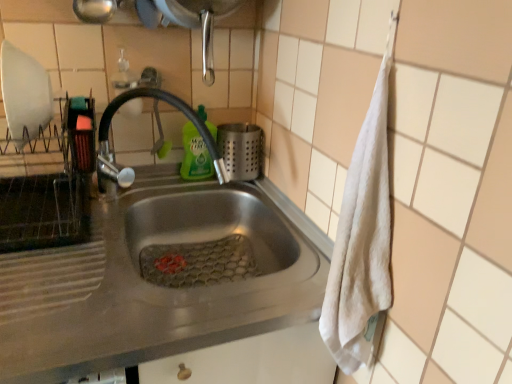
Question: Considering the positions of stainless steel sink at center and satin silver utensil holder at sink in the image, is stainless steel sink at center wider or thinner than satin silver utensil holder at sink?

Choices:
 (A) thin
 (B) wide

Answer: (B)

Question: Based on their positions, is stainless steel sink at center located to the left or right of satin silver utensil holder at sink?

Choices:
 (A) left
 (B) right

Answer: (A)

Question: Which of these objects is positioned closest to the stainless steel sink at center?

Choices:
 (A) satin silver utensil holder at sink
 (B) green liquid at sink
 (C) shiny metallic faucet at center

Answer: (C)

Question: Which is farther from the green liquid at sink?

Choices:
 (A) shiny metallic faucet at center
 (B) satin silver utensil holder at sink
 (C) stainless steel sink at center

Answer: (C)